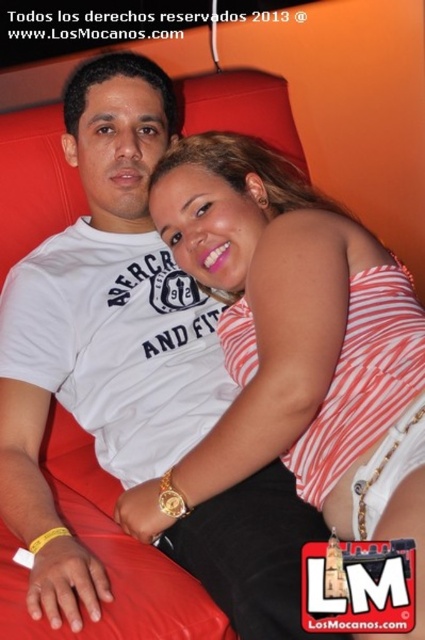
Question: In this image, where is white cotton t-shirt at center located relative to white striped tank top at center?

Choices:
 (A) left
 (B) right

Answer: (A)

Question: Which point appears farthest from the camera in this image?

Choices:
 (A) (305, 472)
 (B) (286, 570)

Answer: (A)

Question: Which point is closer to the camera taking this photo?

Choices:
 (A) (96, 280)
 (B) (286, 384)

Answer: (B)

Question: Does white cotton t-shirt at center have a lesser width compared to white striped tank top at center?

Choices:
 (A) yes
 (B) no

Answer: (B)

Question: Can you confirm if white cotton t-shirt at center is positioned to the right of white striped tank top at center?

Choices:
 (A) no
 (B) yes

Answer: (A)